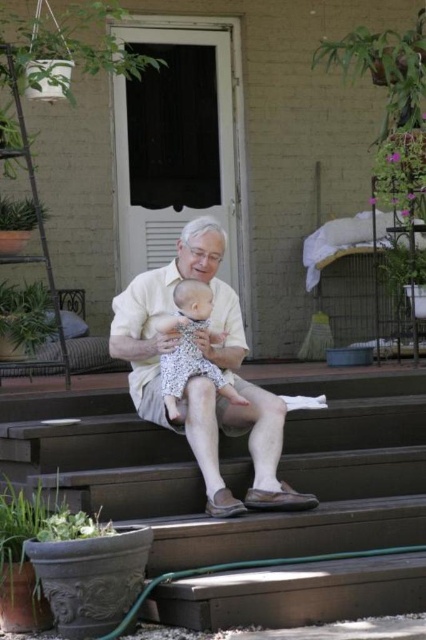
Between point (226, 308) and point (178, 312), which one is positioned in front?

Point (178, 312) is more forward.

Is point (178, 272) in front of point (189, 371)?

That is False.

The width and height of the screenshot is (426, 640). Identify the location of light beige cotton shirt at center. (203, 376).

At what (x,y) coordinates should I click in order to perform the action: click on light beige cotton shirt at center. Please return your answer as a coordinate pair (x, y). Looking at the image, I should click on (203, 376).

Can you confirm if brown wooden stairs at center is shorter than light beige cotton shirt at center?

Indeed, brown wooden stairs at center has a lesser height compared to light beige cotton shirt at center.

Between brown wooden stairs at center and light beige cotton shirt at center, which one has more height?

With more height is light beige cotton shirt at center.

Between point (92, 472) and point (198, 244), which one is positioned in front?

Positioned in front is point (92, 472).

The width and height of the screenshot is (426, 640). Find the location of `brown wooden stairs at center`. brown wooden stairs at center is located at coordinates (201, 481).

Is brown wooden stairs at center to the left of white lace dress at center from the viewer's perspective?

No, brown wooden stairs at center is not to the left of white lace dress at center.

Does brown wooden stairs at center have a lesser height compared to white lace dress at center?

No.

Find the location of a particular element. This screenshot has width=426, height=640. brown wooden stairs at center is located at coordinates 201,481.